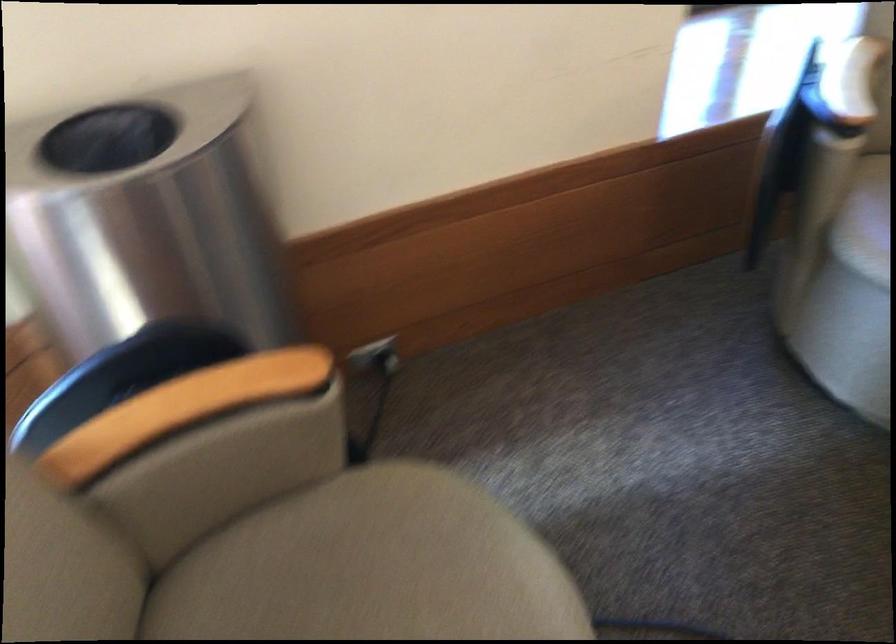
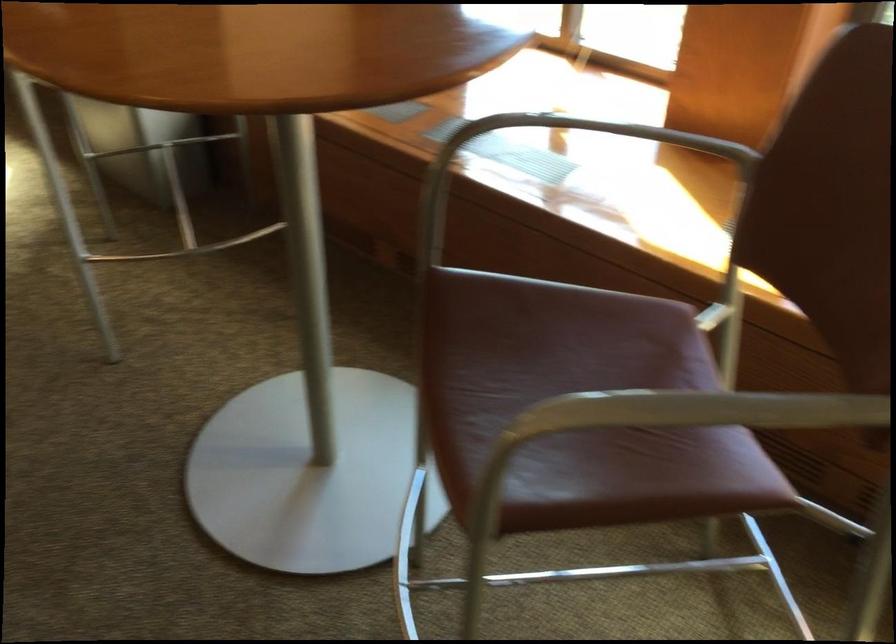
How did the camera likely rotate?

The camera rotated toward left-down.